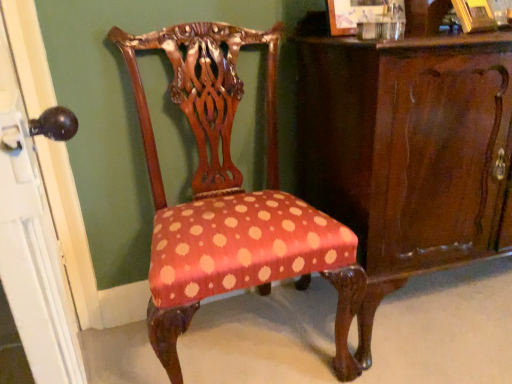
Question: Is polka dot fabric chair at center smaller than shiny dark wood vanity at center?

Choices:
 (A) no
 (B) yes

Answer: (B)

Question: Does polka dot fabric chair at center appear on the left side of shiny dark wood vanity at center?

Choices:
 (A) yes
 (B) no

Answer: (A)

Question: From the image's perspective, is polka dot fabric chair at center located beneath shiny dark wood vanity at center?

Choices:
 (A) no
 (B) yes

Answer: (B)

Question: Can you confirm if polka dot fabric chair at center is bigger than shiny dark wood vanity at center?

Choices:
 (A) yes
 (B) no

Answer: (B)

Question: Considering the relative positions of polka dot fabric chair at center and shiny dark wood vanity at center in the image provided, is polka dot fabric chair at center to the right of shiny dark wood vanity at center from the viewer's perspective?

Choices:
 (A) no
 (B) yes

Answer: (A)

Question: From a real-world perspective, is matte black knob at left physically located above or below polka dot fabric chair at center?

Choices:
 (A) below
 (B) above

Answer: (B)

Question: In terms of width, does matte black knob at left look wider or thinner when compared to polka dot fabric chair at center?

Choices:
 (A) wide
 (B) thin

Answer: (B)

Question: From the image's perspective, is matte black knob at left located above or below polka dot fabric chair at center?

Choices:
 (A) above
 (B) below

Answer: (B)

Question: Do you think matte black knob at left is within polka dot fabric chair at center, or outside of it?

Choices:
 (A) outside
 (B) inside

Answer: (A)

Question: From a real-world perspective, is polka dot fabric chair at center above or below shiny dark wood vanity at center?

Choices:
 (A) below
 (B) above

Answer: (B)

Question: Is polka dot fabric chair at center taller or shorter than shiny dark wood vanity at center?

Choices:
 (A) short
 (B) tall

Answer: (B)

Question: In the image, is polka dot fabric chair at center positioned in front of or behind shiny dark wood vanity at center?

Choices:
 (A) behind
 (B) front

Answer: (B)

Question: Considering the positions of polka dot fabric chair at center and shiny dark wood vanity at center in the image, is polka dot fabric chair at center bigger or smaller than shiny dark wood vanity at center?

Choices:
 (A) big
 (B) small

Answer: (B)

Question: In the image, is shiny dark wood vanity at center positioned in front of or behind polka dot fabric chair at center?

Choices:
 (A) behind
 (B) front

Answer: (A)

Question: From the image's perspective, is shiny dark wood vanity at center above or below polka dot fabric chair at center?

Choices:
 (A) above
 (B) below

Answer: (A)